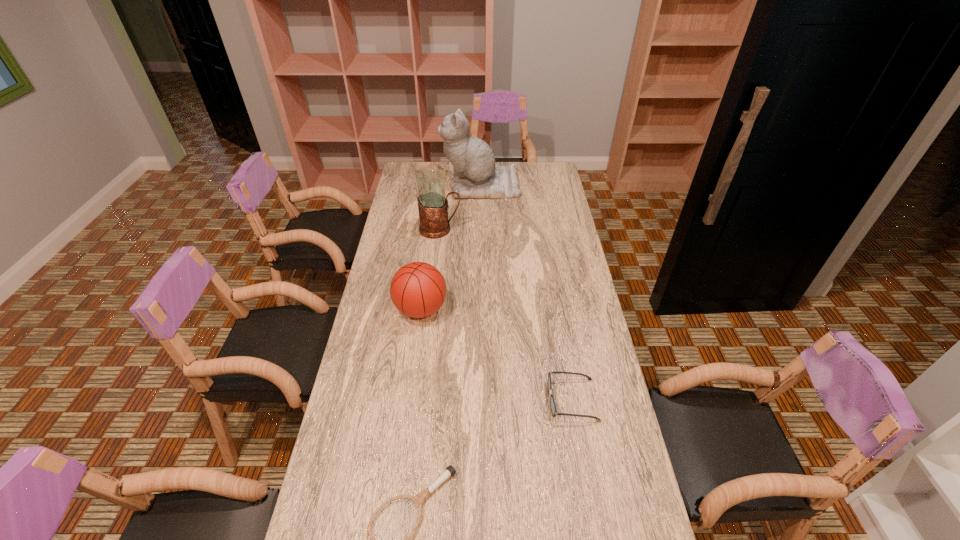
You are a GUI agent. You are given a task and a screenshot of the screen. Output one action in this format:
    pyautogui.click(x=<x>, y=<y>)
    Task: Click on the tallest object
    
    Given the screenshot: What is the action you would take?
    coord(475,174)

I want to click on cat, so click(475, 174).

Find the location of a particular element. This screenshot has height=540, width=960. the second farthest object is located at coordinates (432, 201).

Image resolution: width=960 pixels, height=540 pixels. What are the coordinates of `pitcher` in the screenshot? It's located at (432, 201).

Find the location of a particular element. basketball is located at coordinates (418, 289).

At what (x,y) coordinates should I click in order to perform the action: click on the third farthest object. Please return your answer as a coordinate pair (x, y). This screenshot has height=540, width=960. Looking at the image, I should click on (418, 289).

You are a GUI agent. You are given a task and a screenshot of the screen. Output one action in this format:
    pyautogui.click(x=<x>, y=<y>)
    Task: Click on the spectacles
    The width and height of the screenshot is (960, 540).
    Given the screenshot: What is the action you would take?
    pyautogui.click(x=552, y=402)

Locate an element on the screen. the rightmost object is located at coordinates (552, 402).

This screenshot has height=540, width=960. What are the coordinates of `vacant space located on the front-facing side of the farthest object` in the screenshot? It's located at (432, 185).

Identify the location of blank area located 0.150m on the front-facing side of the farthest object. (412, 185).